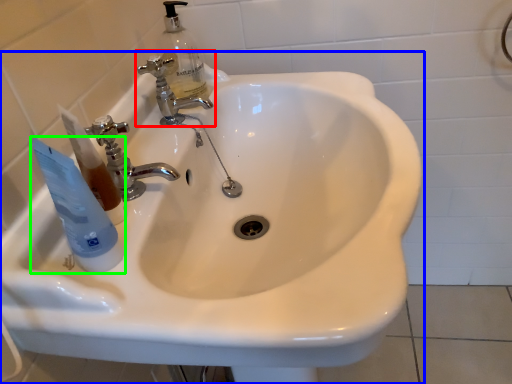
Question: Based on their relative distances, which object is nearer to tap (highlighted by a red box)? Choose from sink (highlighted by a blue box) and mouthwash (highlighted by a green box).

Choices:
 (A) sink
 (B) mouthwash

Answer: (A)